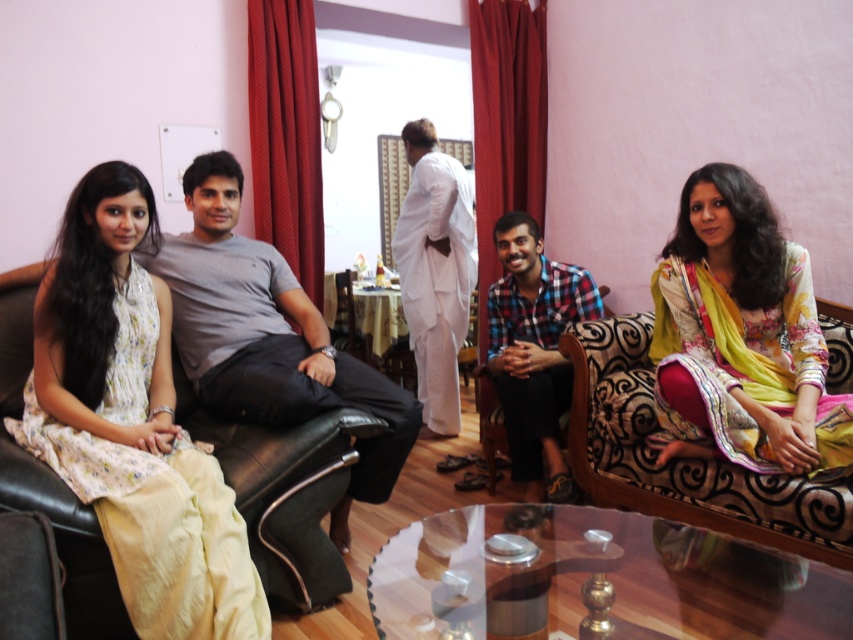
How far apart are gray cotton t-shirt at left and white cotton kurta at center?

gray cotton t-shirt at left is 4.28 feet away from white cotton kurta at center.

Does gray cotton t-shirt at left have a lesser height compared to white cotton kurta at center?

Yes.

In the scene shown: Who is more distant from viewer, (276, 294) or (430, 369)?

The point (430, 369) is more distant.

At what (x,y) coordinates should I click in order to perform the action: click on gray cotton t-shirt at left. Please return your answer as a coordinate pair (x, y). Looking at the image, I should click on (270, 337).

Does gray cotton t-shirt at left have a lesser height compared to black leather chair at center?

Incorrect, gray cotton t-shirt at left's height does not fall short of black leather chair at center's.

Is gray cotton t-shirt at left to the right of black leather chair at center from the viewer's perspective?

Correct, you'll find gray cotton t-shirt at left to the right of black leather chair at center.

The image size is (853, 640). In order to click on gray cotton t-shirt at left in this screenshot , I will do `click(270, 337)`.

Is plaid fabric shirt at center taller than black leather chair at center?

Indeed, plaid fabric shirt at center has a greater height compared to black leather chair at center.

Which is more to the right, plaid fabric shirt at center or black leather chair at center?

From the viewer's perspective, plaid fabric shirt at center appears more on the right side.

Identify the location of plaid fabric shirt at center. (534, 348).